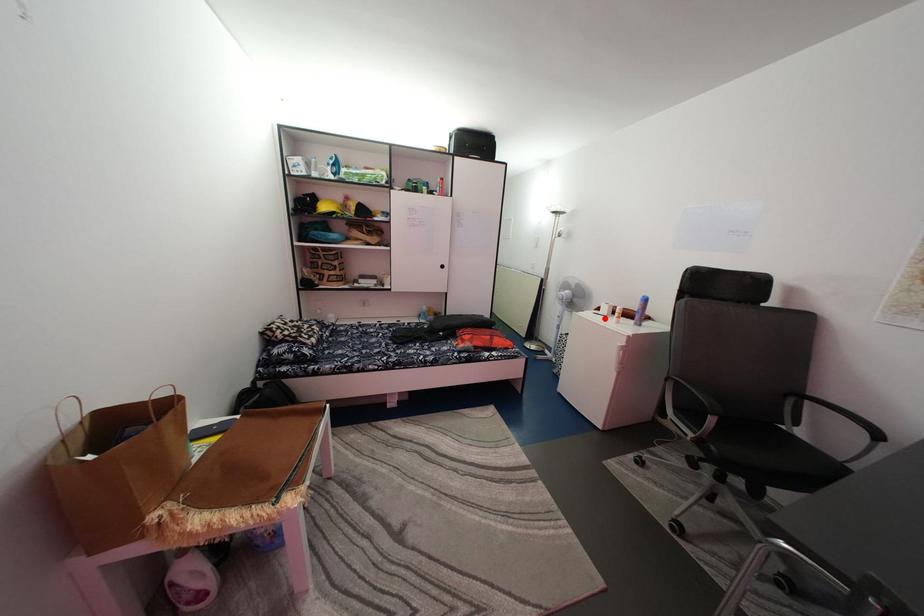
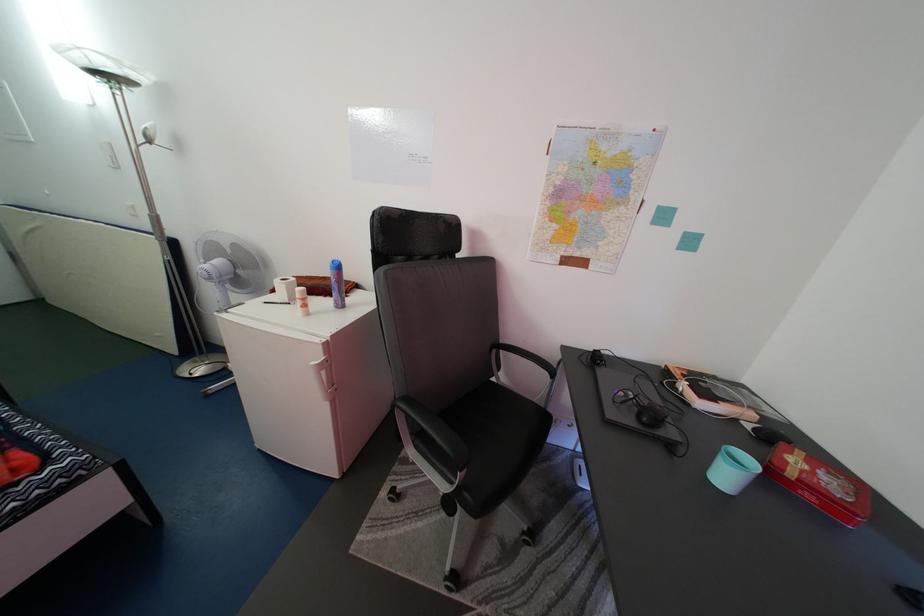
In the second image, find the point that corresponds to the highlighted location in the first image.

(280, 304)